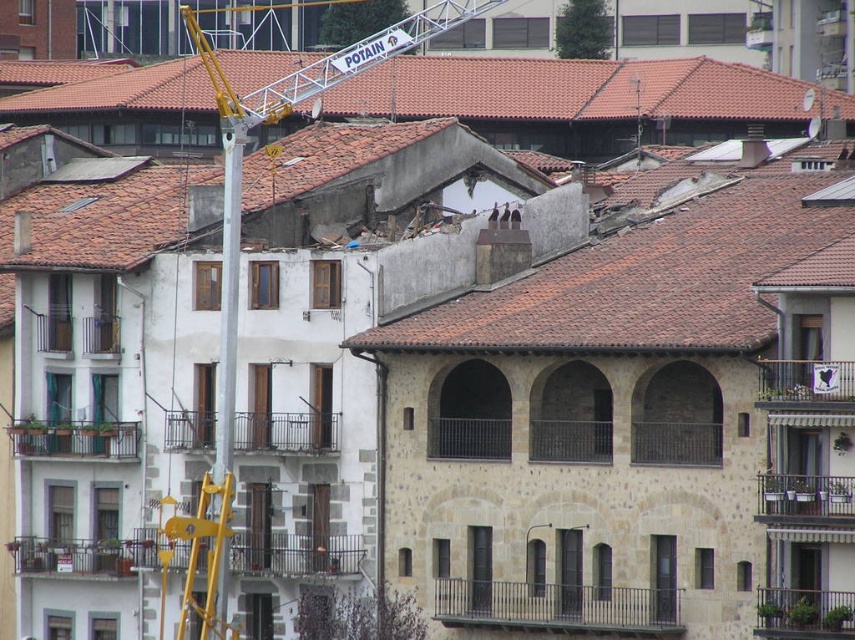
The height and width of the screenshot is (640, 855). What do you see at coordinates (641, 282) in the screenshot?
I see `terracotta tiled roof at center` at bounding box center [641, 282].

Consider the image. Does terracotta tiled roof at center come behind yellow metallic ladder at center?

That is False.

Where is `terracotta tiled roof at center`? terracotta tiled roof at center is located at coordinates (641, 282).

Is point (688, 237) in front of point (239, 136)?

That is False.

Can you confirm if terracotta tiled roof at center is taller than silver metallic pole at center?

In fact, terracotta tiled roof at center may be shorter than silver metallic pole at center.

Locate an element on the screen. The height and width of the screenshot is (640, 855). terracotta tiled roof at center is located at coordinates (641, 282).

Does brown tile roof at upper center have a lesser height compared to silver metallic pole at center?

Yes, brown tile roof at upper center is shorter than silver metallic pole at center.

Who is shorter, brown tile roof at upper center or silver metallic pole at center?

brown tile roof at upper center is shorter.

Is point (396, 61) farther from viewer compared to point (225, 296)?

That is True.

The height and width of the screenshot is (640, 855). I want to click on brown tile roof at upper center, so click(x=568, y=90).